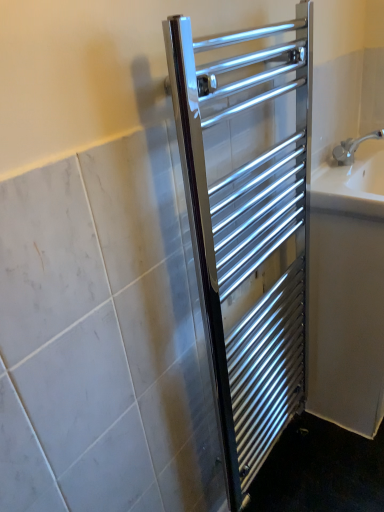
Question: Considering the relative positions of white glossy bath at right and polished chrome towel rack at center in the image provided, is white glossy bath at right to the left of polished chrome towel rack at center from the viewer's perspective?

Choices:
 (A) no
 (B) yes

Answer: (A)

Question: Can you confirm if white glossy bath at right is shorter than polished chrome towel rack at center?

Choices:
 (A) no
 (B) yes

Answer: (B)

Question: From the image's perspective, would you say white glossy bath at right is positioned over polished chrome towel rack at center?

Choices:
 (A) yes
 (B) no

Answer: (B)

Question: From the image's perspective, would you say white glossy bath at right is shown under polished chrome towel rack at center?

Choices:
 (A) no
 (B) yes

Answer: (B)

Question: Can you confirm if white glossy bath at right is smaller than polished chrome towel rack at center?

Choices:
 (A) no
 (B) yes

Answer: (A)

Question: Is white glossy bath at right further to the viewer compared to polished chrome towel rack at center?

Choices:
 (A) yes
 (B) no

Answer: (A)

Question: Can you confirm if white glossy bath at right is thinner than white ceramic sink at right?

Choices:
 (A) no
 (B) yes

Answer: (A)

Question: From a real-world perspective, is white glossy bath at right physically above white ceramic sink at right?

Choices:
 (A) no
 (B) yes

Answer: (A)

Question: Considering the relative sizes of white glossy bath at right and white ceramic sink at right in the image provided, is white glossy bath at right taller than white ceramic sink at right?

Choices:
 (A) yes
 (B) no

Answer: (A)

Question: Is white glossy bath at right turned away from white ceramic sink at right?

Choices:
 (A) no
 (B) yes

Answer: (A)

Question: Is white glossy bath at right beside white ceramic sink at right?

Choices:
 (A) yes
 (B) no

Answer: (B)

Question: Is the depth of white glossy bath at right greater than that of white ceramic sink at right?

Choices:
 (A) no
 (B) yes

Answer: (B)

Question: Is white ceramic sink at right surrounding white glossy bath at right?

Choices:
 (A) no
 (B) yes

Answer: (A)